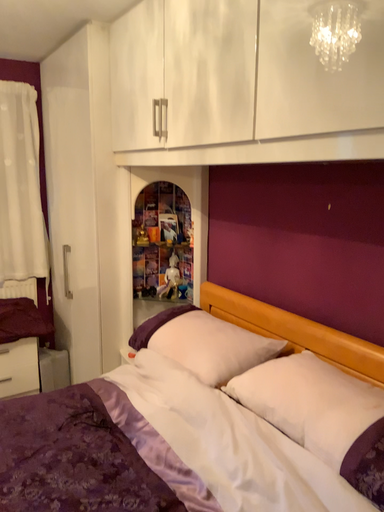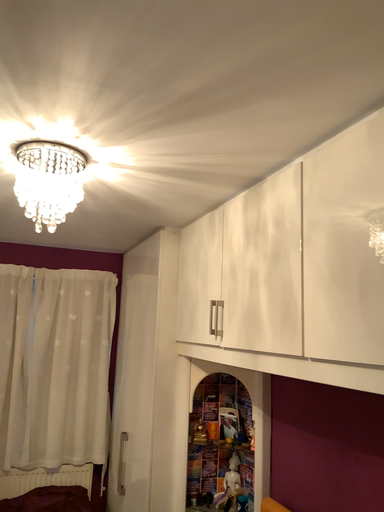
Question: How did the camera likely rotate when shooting the video?

Choices:
 (A) rotated left
 (B) rotated right

Answer: (A)